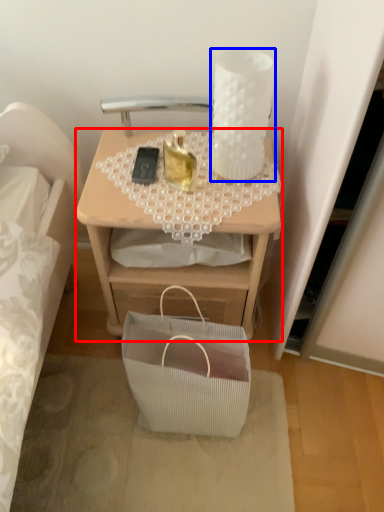
Question: Among these objects, which one is farthest to the camera, desk (highlighted by a red box) or candle holder (highlighted by a blue box)?

Choices:
 (A) desk
 (B) candle holder

Answer: (A)